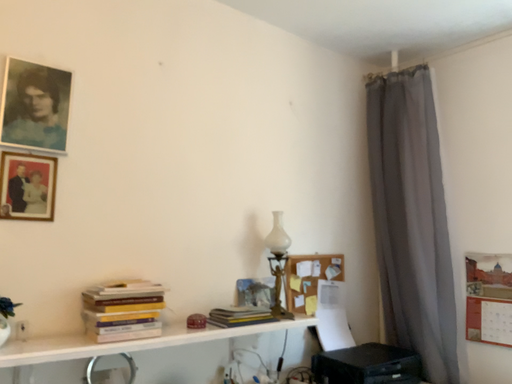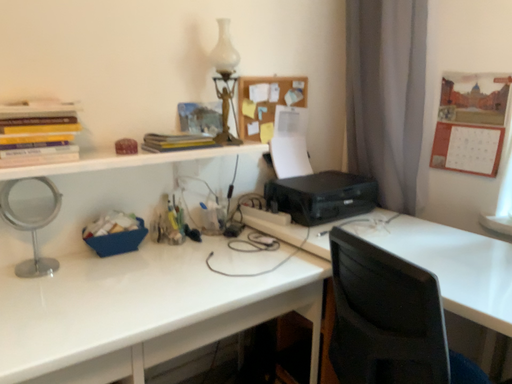
Question: How did the camera likely rotate when shooting the video?

Choices:
 (A) rotated upward
 (B) rotated downward

Answer: (B)